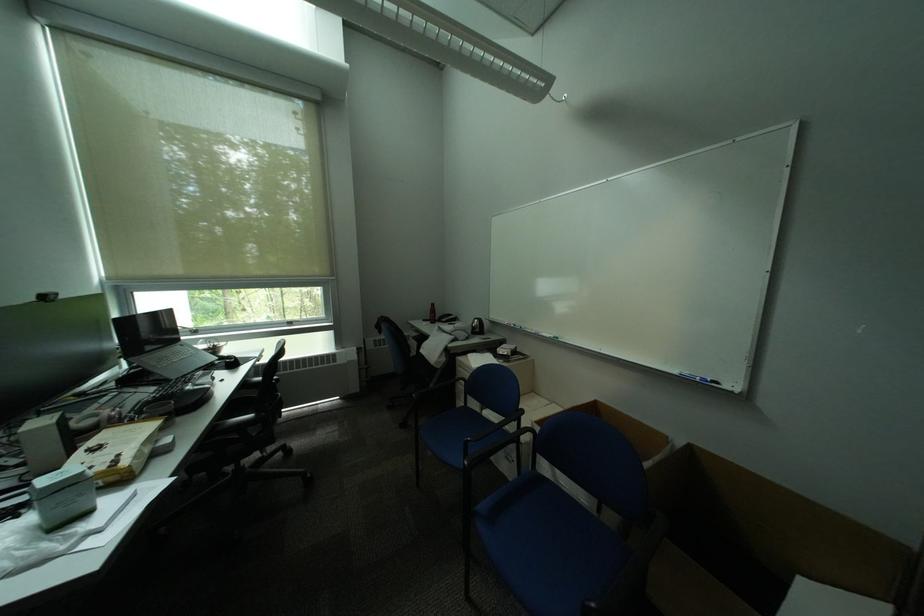
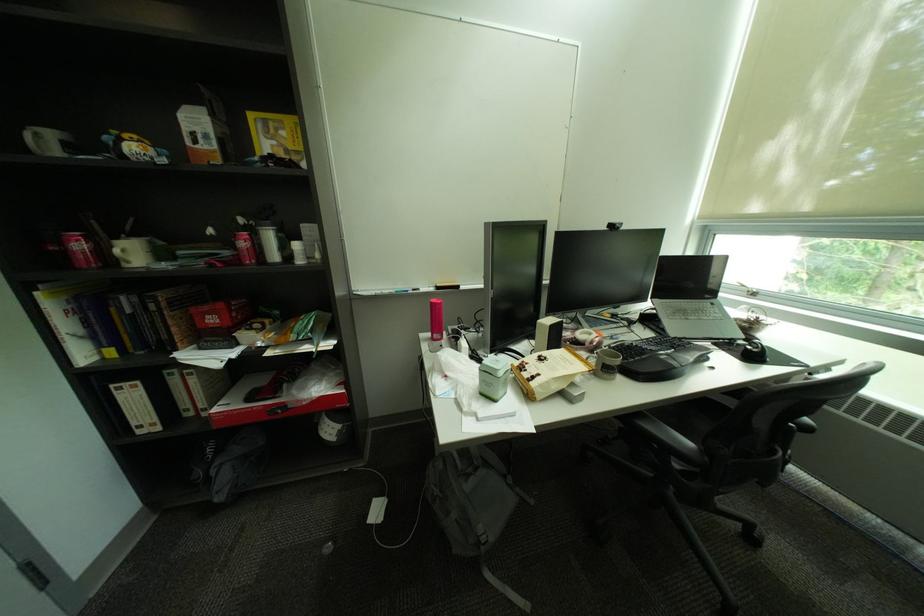
In the second image, find the point that corresponds to pixel 262 416 in the first image.

(700, 445)